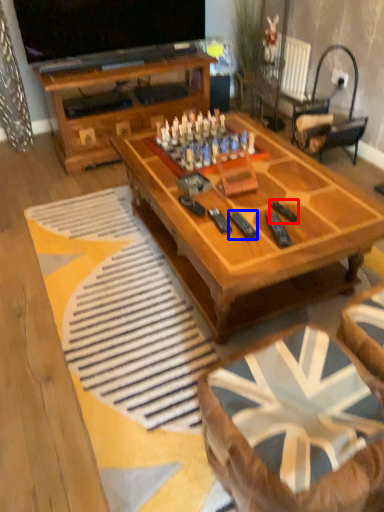
Question: Which object appears closest to the camera in this image, remote (highlighted by a red box) or remote (highlighted by a blue box)?

Choices:
 (A) remote
 (B) remote

Answer: (B)